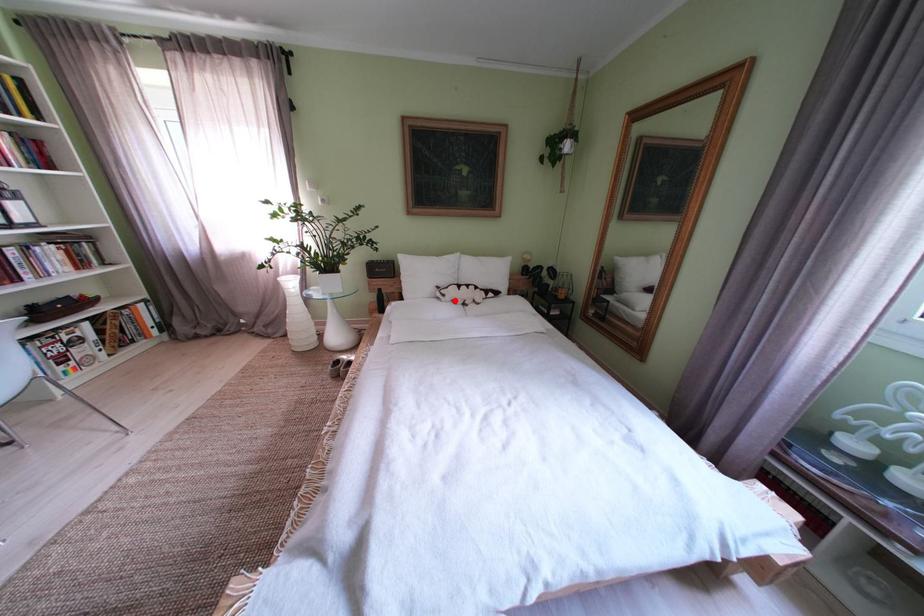
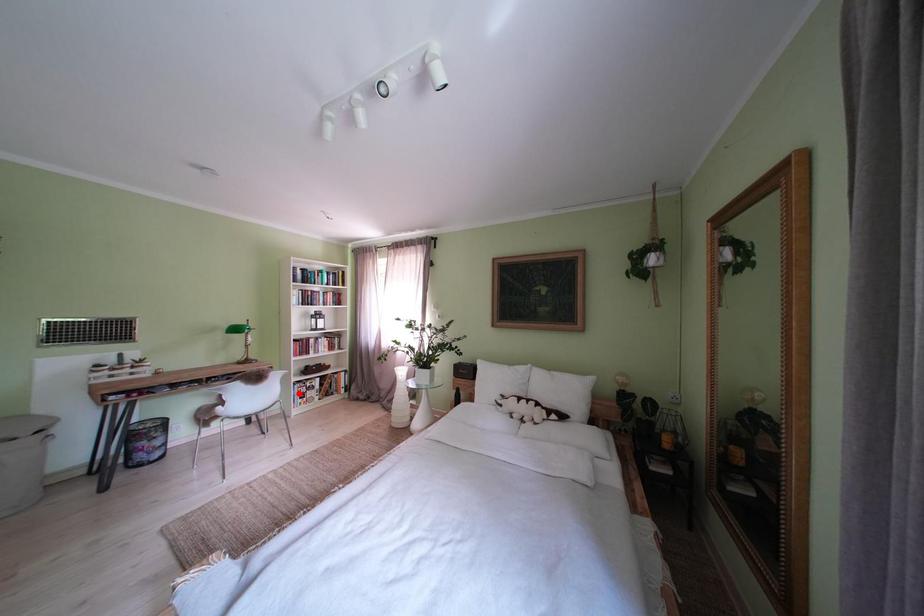
I am providing you with two images of the same scene from different viewpoints. A red point is marked on the first image and another point is marked on the second image. Is the red point in image1 aligned with the point shown in image2?

No